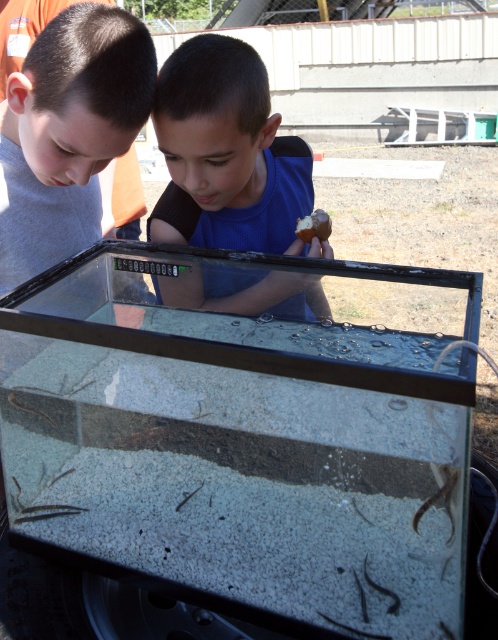
Question: Which of the following is the farthest from the observer?

Choices:
 (A) brown matte potato at center
 (B) transparent glass tank at center
 (C) blue matte shirt at center

Answer: (A)

Question: Which point is closer to the camera taking this photo?

Choices:
 (A) (253, 278)
 (B) (327, 221)
 (C) (143, 461)

Answer: (C)

Question: Is transparent glass tank at center positioned behind brown matte potato at center?

Choices:
 (A) yes
 (B) no

Answer: (B)

Question: Which point is closer to the camera?

Choices:
 (A) blue matte shirt at center
 (B) brown matte potato at center
 (C) transparent glass tank at center

Answer: (C)

Question: Does transparent glass tank at center lie in front of brown matte potato at center?

Choices:
 (A) no
 (B) yes

Answer: (B)

Question: Observing the image, what is the correct spatial positioning of transparent glass tank at center in reference to blue matte shirt at center?

Choices:
 (A) below
 (B) above

Answer: (A)